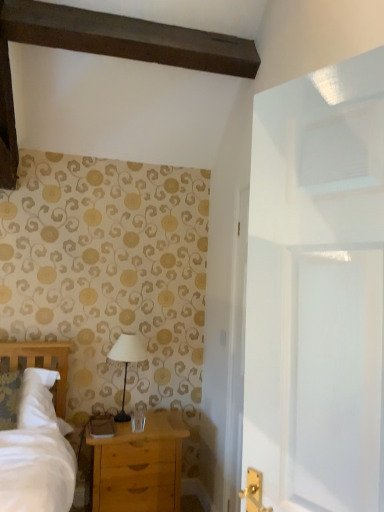
Question: Considering the relative sizes of light brown wooden chest of drawers at lower left and white fabric lampshade at center in the image provided, is light brown wooden chest of drawers at lower left thinner than white fabric lampshade at center?

Choices:
 (A) no
 (B) yes

Answer: (A)

Question: Does light brown wooden chest of drawers at lower left have a greater height compared to white fabric lampshade at center?

Choices:
 (A) yes
 (B) no

Answer: (A)

Question: Does light brown wooden chest of drawers at lower left come behind white fabric lampshade at center?

Choices:
 (A) no
 (B) yes

Answer: (A)

Question: Is light brown wooden chest of drawers at lower left smaller than white fabric lampshade at center?

Choices:
 (A) no
 (B) yes

Answer: (A)

Question: From the image's perspective, is light brown wooden chest of drawers at lower left under white fabric lampshade at center?

Choices:
 (A) no
 (B) yes

Answer: (B)

Question: Can we say light brown wooden chest of drawers at lower left lies outside white fabric lampshade at center?

Choices:
 (A) yes
 (B) no

Answer: (A)

Question: Would you say white fabric lampshade at center is outside light brown wooden chest of drawers at lower left?

Choices:
 (A) no
 (B) yes

Answer: (B)

Question: Would you say white fabric lampshade at center is a long distance from light brown wooden chest of drawers at lower left?

Choices:
 (A) no
 (B) yes

Answer: (A)

Question: From the image's perspective, is white fabric lampshade at center located above light brown wooden chest of drawers at lower left?

Choices:
 (A) no
 (B) yes

Answer: (B)

Question: Is light brown wooden chest of drawers at lower left inside white fabric lampshade at center?

Choices:
 (A) yes
 (B) no

Answer: (B)

Question: Is white fabric lampshade at center thinner than light brown wooden chest of drawers at lower left?

Choices:
 (A) yes
 (B) no

Answer: (A)

Question: From a real-world perspective, is white fabric lampshade at center located beneath light brown wooden chest of drawers at lower left?

Choices:
 (A) no
 (B) yes

Answer: (A)

Question: From their relative heights in the image, would you say white fabric lampshade at center is taller or shorter than light brown wooden chest of drawers at lower left?

Choices:
 (A) tall
 (B) short

Answer: (B)